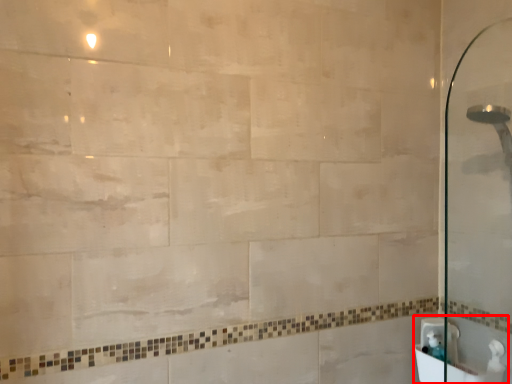
Question: From the image's perspective, where is sink (annotated by the red box) located in relation to sink in the image?

Choices:
 (A) above
 (B) below

Answer: (B)